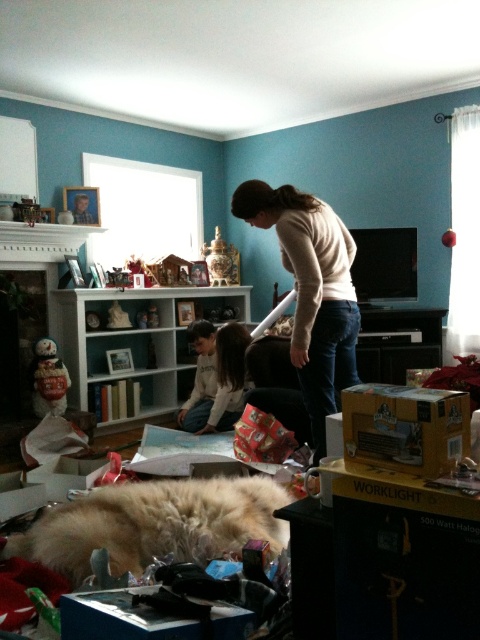
Looking at this image, you are standing in the living room and want to take a photo of the point at coordinates (434, 420). Your camera has a focal length of 50mm and a sensor size of 24mm. What is the minimum distance you need to be from the point to ensure it fills the frame?

The point at coordinates (434, 420) is 3.55 feet from the camera. To ensure the point fills the frame, you must be at least 3.55 feet away from it.

You are standing in the living room and want to place a new decoration exactly at the point marked by the coordinates point (406, 428). What object is located at that point?

The point (406, 428) corresponds to the yellow cardboard box at lower right.